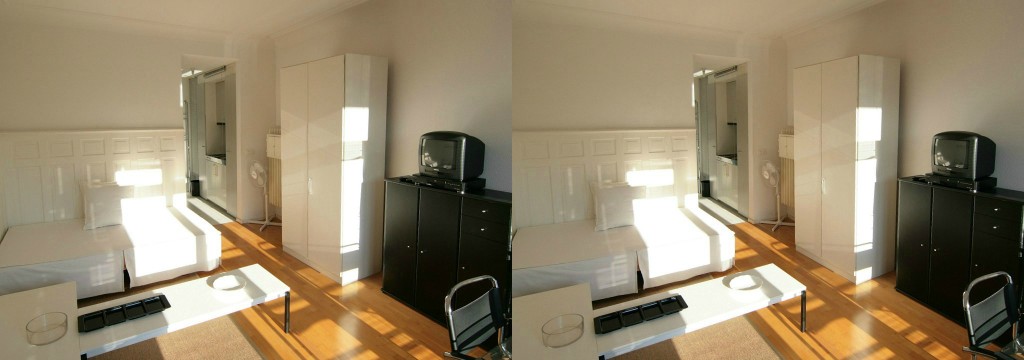
At what (x,y) coordinates should I click in order to perform the action: click on ceiling. Please return your answer as a coordinate pair (x, y). The height and width of the screenshot is (360, 1024). Looking at the image, I should click on (252, 15), (742, 11).